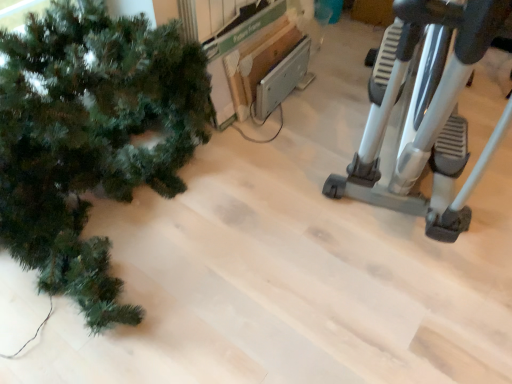
Question: Is green matte christmas tree at left aimed at silver metallic stationary bicycle at right?

Choices:
 (A) no
 (B) yes

Answer: (A)

Question: Can you confirm if green matte christmas tree at left is smaller than silver metallic stationary bicycle at right?

Choices:
 (A) yes
 (B) no

Answer: (A)

Question: Is green matte christmas tree at left turned away from silver metallic stationary bicycle at right?

Choices:
 (A) no
 (B) yes

Answer: (A)

Question: Would you consider green matte christmas tree at left to be distant from silver metallic stationary bicycle at right?

Choices:
 (A) no
 (B) yes

Answer: (A)

Question: Can you confirm if green matte christmas tree at left is shorter than silver metallic stationary bicycle at right?

Choices:
 (A) no
 (B) yes

Answer: (B)

Question: From a real-world perspective, is green matte christmas tree at left on top of silver metallic stationary bicycle at right?

Choices:
 (A) no
 (B) yes

Answer: (A)

Question: Is silver metallic stationary bicycle at right at the right side of green matte christmas tree at left?

Choices:
 (A) yes
 (B) no

Answer: (A)

Question: Is silver metallic stationary bicycle at right to the left of green matte christmas tree at left from the viewer's perspective?

Choices:
 (A) no
 (B) yes

Answer: (A)

Question: Considering the relative sizes of silver metallic stationary bicycle at right and green matte christmas tree at left in the image provided, is silver metallic stationary bicycle at right taller than green matte christmas tree at left?

Choices:
 (A) yes
 (B) no

Answer: (A)

Question: Is the depth of silver metallic stationary bicycle at right less than that of green matte christmas tree at left?

Choices:
 (A) no
 (B) yes

Answer: (B)

Question: Does silver metallic stationary bicycle at right have a lesser width compared to green matte christmas tree at left?

Choices:
 (A) no
 (B) yes

Answer: (A)

Question: From the image's perspective, is silver metallic stationary bicycle at right above green matte christmas tree at left?

Choices:
 (A) yes
 (B) no

Answer: (A)

Question: Do you think silver metallic stationary bicycle at right is within green matte christmas tree at left, or outside of it?

Choices:
 (A) outside
 (B) inside

Answer: (A)